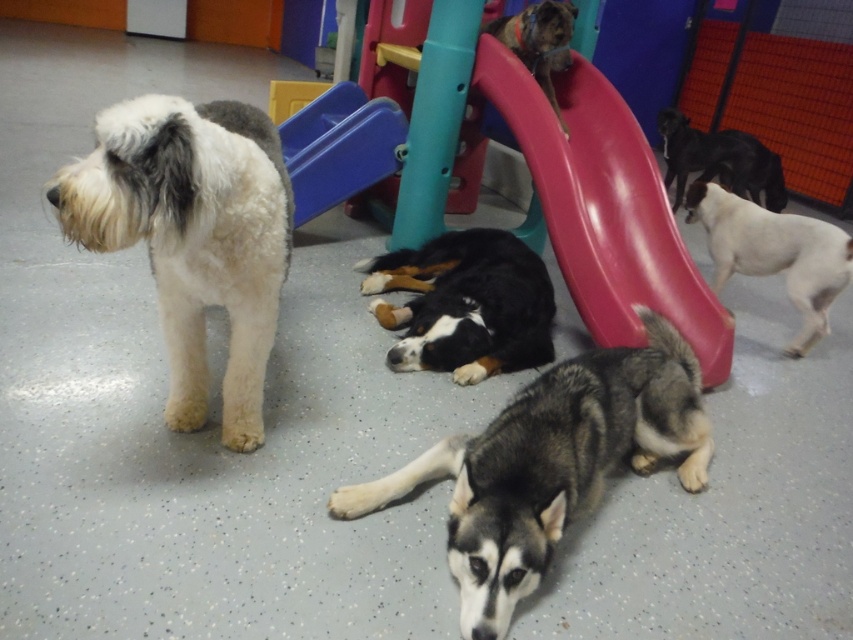
You are a photographer setting up a shoot in the scene. You want to position a light source so that it illuminates both the white fur dog at right and the black glossy dog at upper right without casting shadows between them. Based on their positions, where should you place the light source?

The white fur dog at right is located below the black glossy dog at upper right. To avoid shadows between them, the light source should be placed above and slightly behind the black glossy dog at upper right so that it shines downward, illuminating both dogs while minimizing shadow overlap.

You are standing 5 feet away from the camera. You want to pet the white fluffy dog at left. Can you reach the dog without moving closer?

The white fluffy dog at left is 4.82 feet away from the camera. Since you are 5 feet away from the camera, you are farther than the dog, so you cannot reach it without moving closer.

You are a photographer setting up a shoot in this room. You want to capture both the white fur dog at right and the black glossy dog at upper right in the same frame. Based on their positions, which dog will appear closer to the camera in the photo?

The white fur dog at right will appear closer to the camera because it is positioned in front of the black glossy dog at upper right.